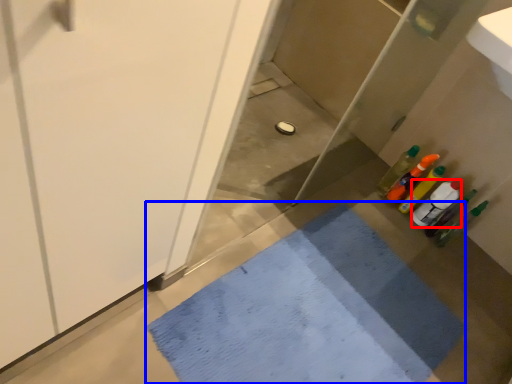
Question: Among these objects, which one is nearest to the camera, bottle (highlighted by a red box) or bath mat (highlighted by a blue box)?

Choices:
 (A) bottle
 (B) bath mat

Answer: (B)